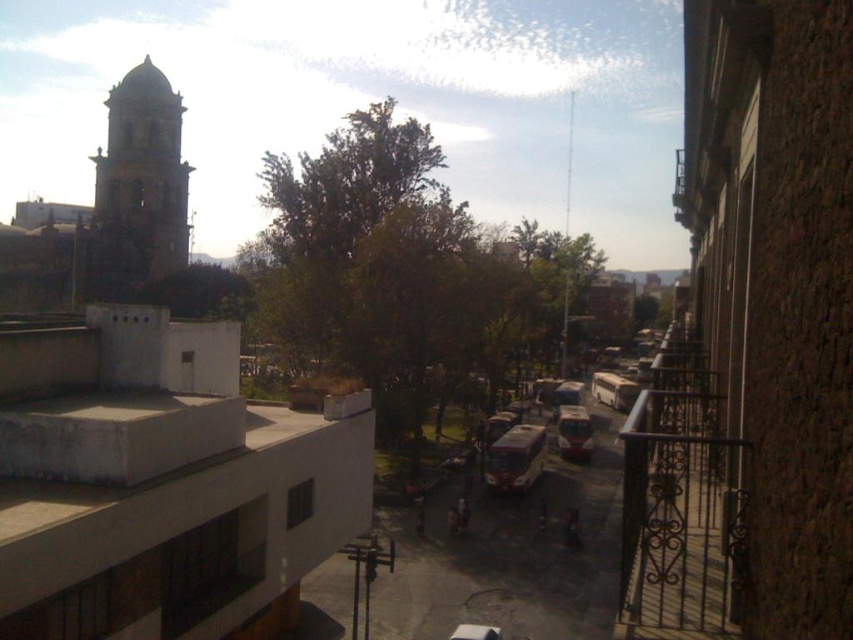
Question: Which of the following is the farthest from the observer?

Choices:
 (A) metallic silver bus at center
 (B) dark gray stone bell tower at upper left

Answer: (B)

Question: Among these objects, which one is farthest from the camera?

Choices:
 (A) dark gray stone bell tower at upper left
 (B) metallic silver bus at center

Answer: (A)

Question: Does dark gray stone bell tower at upper left have a lesser width compared to metallic silver bus at center?

Choices:
 (A) no
 (B) yes

Answer: (A)

Question: Can you confirm if dark gray stone bell tower at upper left is smaller than metallic silver bus at center?

Choices:
 (A) yes
 (B) no

Answer: (B)

Question: Can you confirm if dark gray stone bell tower at upper left is positioned below metallic silver bus at center?

Choices:
 (A) no
 (B) yes

Answer: (A)

Question: Which of the following is the closest to the observer?

Choices:
 (A) (158, 227)
 (B) (566, 445)

Answer: (B)